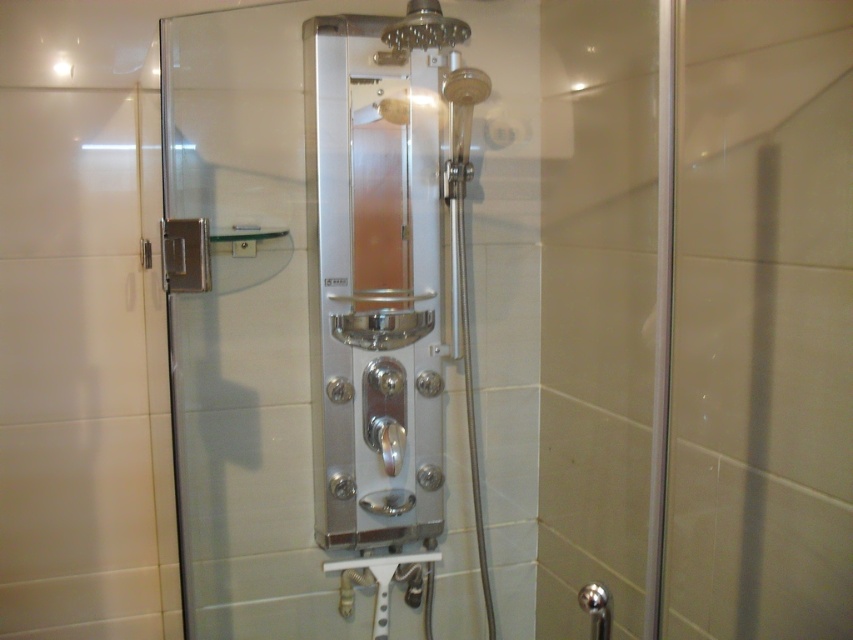
Between point (289, 157) and point (428, 440), which one is positioned in front?

Point (289, 157) is more forward.

Who is more distant from viewer, (347, 211) or (360, 84)?

The point (347, 211) is behind.

Image resolution: width=853 pixels, height=640 pixels. I want to click on silver metallic shower door at center, so click(312, 308).